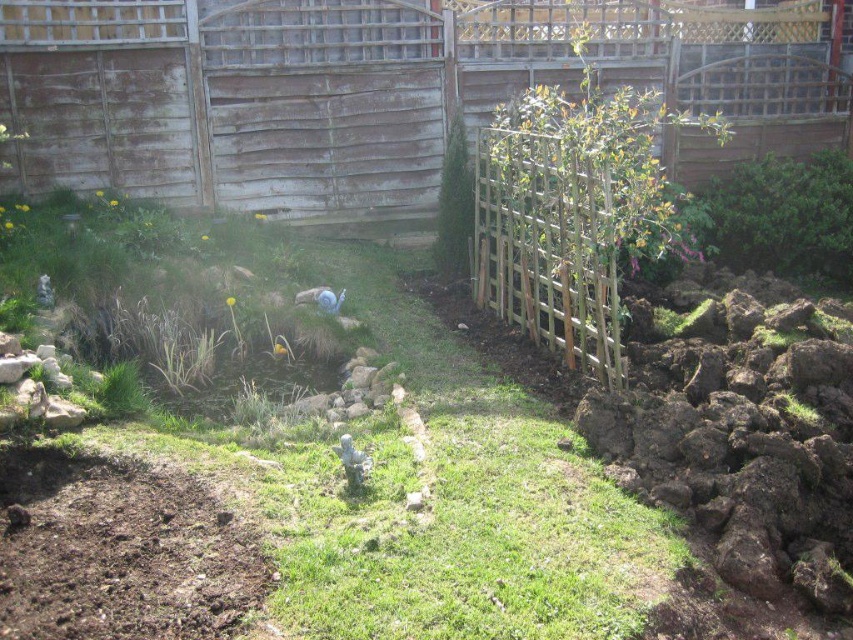
Which of these two, green grass at center or weathered wood fence at upper center, stands shorter?

Standing shorter between the two is green grass at center.

Is point (258, 324) farther from camera compared to point (445, 45)?

No.

This screenshot has width=853, height=640. Find the location of `green grass at center`. green grass at center is located at coordinates (329, 486).

Find the location of a particular element. Image resolution: width=853 pixels, height=640 pixels. green grass at center is located at coordinates (329, 486).